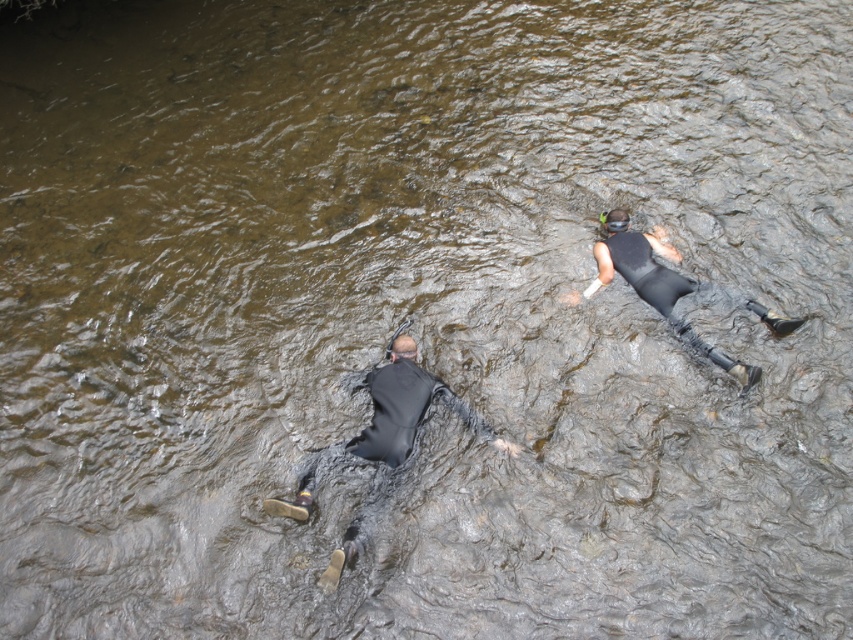
Who is more distant from viewer, (367, 381) or (701, 353)?

Positioned behind is point (701, 353).

Can you confirm if black matte wetsuit at lower left is positioned below black matte wetsuit at upper right?

Yes, black matte wetsuit at lower left is below black matte wetsuit at upper right.

The width and height of the screenshot is (853, 640). Describe the element at coordinates (380, 445) in the screenshot. I see `black matte wetsuit at lower left` at that location.

At what (x,y) coordinates should I click in order to perform the action: click on black matte wetsuit at lower left. Please return your answer as a coordinate pair (x, y). The height and width of the screenshot is (640, 853). Looking at the image, I should click on (380, 445).